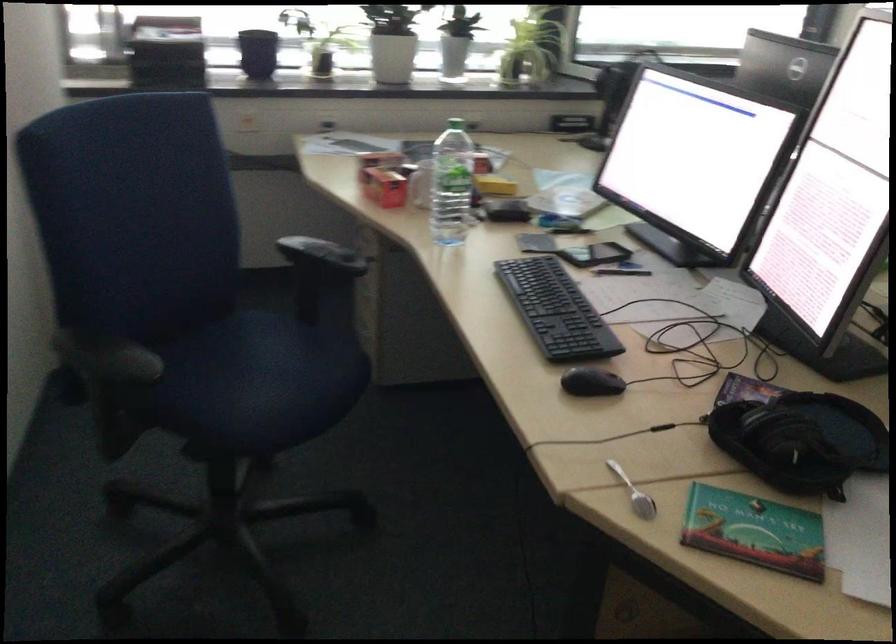
At what (x,y) coordinates should I click in order to perform the action: click on chair sitting surface. Please return your answer as a coordinate pair (x, y). This screenshot has width=896, height=644. Looking at the image, I should click on (245, 365).